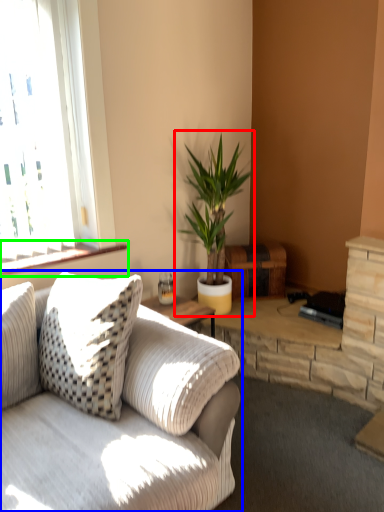
Question: Which is farther away from houseplant (highlighted by a red box)? studio couch (highlighted by a blue box) or window sill (highlighted by a green box)?

Choices:
 (A) studio couch
 (B) window sill

Answer: (A)